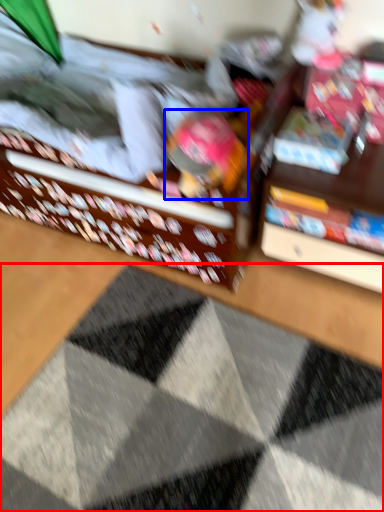
Question: Which point is closer to the camera, doormat (highlighted by a red box) or toy (highlighted by a blue box)?

Choices:
 (A) doormat
 (B) toy

Answer: (A)